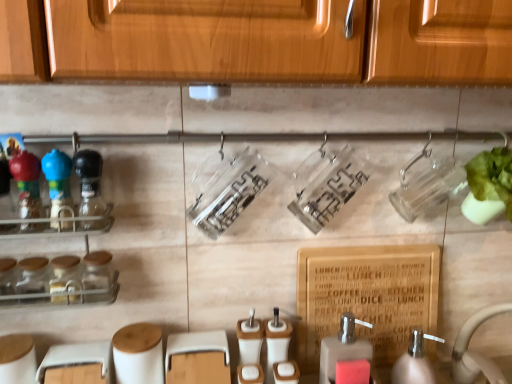
Question: Considering the positions of white plastic soap dispenser at lower right, arranged as the 1th soap dispenser when viewed from the right, and blue glossy bottle at left, which is the 3th bottle in right-to-left order, in the image, is white plastic soap dispenser at lower right, arranged as the 1th soap dispenser when viewed from the right, wider or thinner than blue glossy bottle at left, which is the 3th bottle in right-to-left order,?

Choices:
 (A) thin
 (B) wide

Answer: (B)

Question: Which is correct: white plastic soap dispenser at lower right, which appears as the 2th soap dispenser when viewed from the left, is inside blue glossy bottle at left, which is the 1th bottle in left-to-right order, or outside of it?

Choices:
 (A) outside
 (B) inside

Answer: (A)

Question: Considering the real-world distances, which object is closest to the white plastic soap dispenser at lower right, which appears as the 2th soap dispenser when viewed from the left?

Choices:
 (A) matte brown soap dispenser at lower center, which is counted as the first soap dispenser, starting from the left
 (B) green leafy vegetable at right
 (C) blue glossy bottle at left, which is the 1th bottle in left-to-right order
 (D) matte black bottle at left, the 2th bottle when ordered from right to left
 (E) clear glass spice rack at left

Answer: (A)

Question: Which object is the farthest from the green leafy vegetable at right?

Choices:
 (A) clear plastic container at center, which is counted as the 1th bottle, starting from the right
 (B) clear glass spice rack at left
 (C) white plastic soap dispenser at lower right, which appears as the 2th soap dispenser when viewed from the left
 (D) matte black bottle at left, which is the second bottle in left-to-right order
 (E) blue glossy bottle at left, which is the 3th bottle in right-to-left order

Answer: (E)